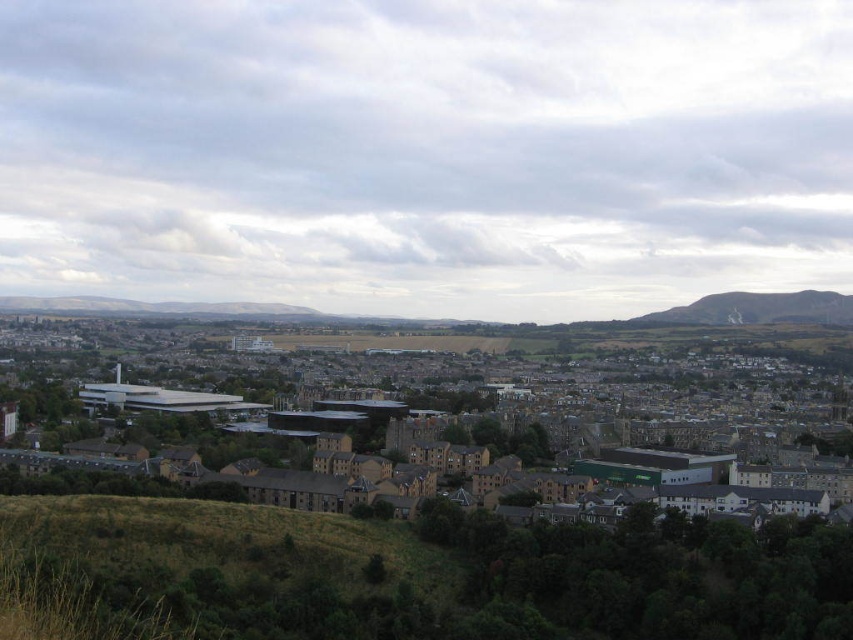
You are a city planner analyzing the urban layout. Given the brown stone buildings at center and the green grassy hill at right, which area occupies more horizontal space in the image?

The brown stone buildings at center occupy more horizontal space than the green grassy hill at right because their width is larger according to the description.